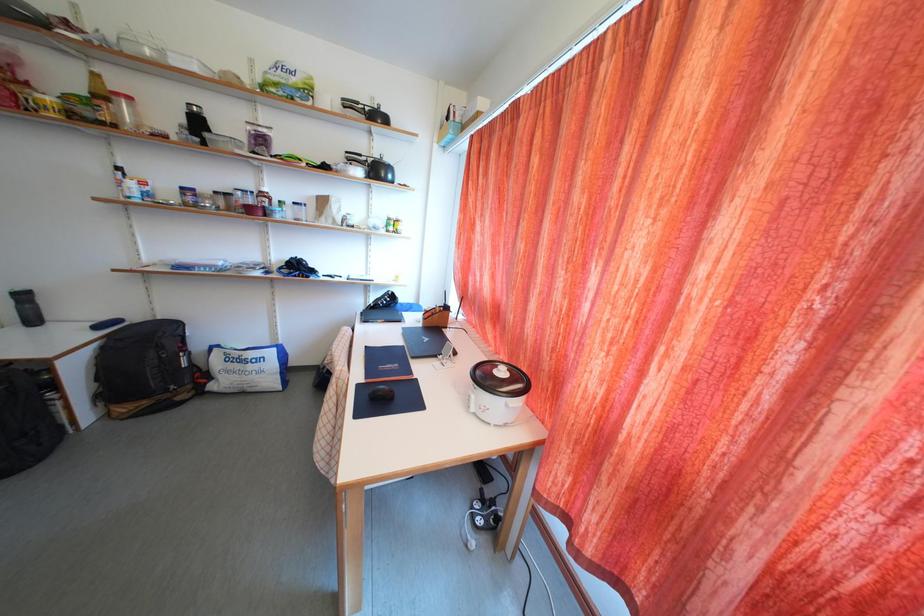
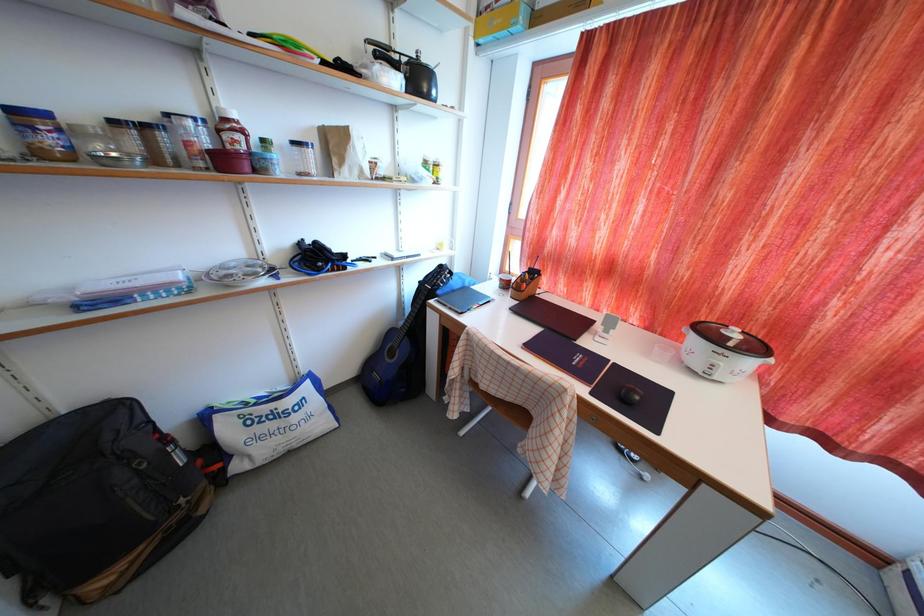
In a continuous first-person perspective shot, in which direction is the camera moving?

The movement direction of the cameraman is left, forward.